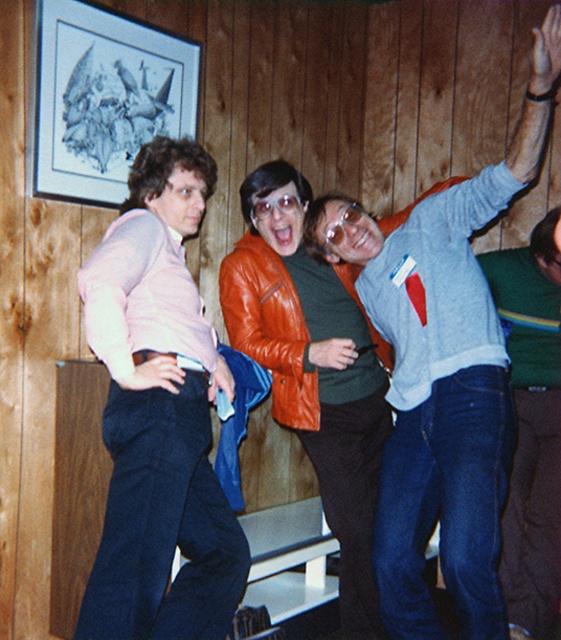
Question: Does light blue sweater at upper right appear over blue jeans at lower right?

Choices:
 (A) no
 (B) yes

Answer: (B)

Question: Based on their relative distances, which object is farther from the leather jacket at center?

Choices:
 (A) light blue sweater at upper right
 (B) blue jeans at lower right

Answer: (B)

Question: Is light blue sweater at upper right positioned in front of blue jeans at lower right?

Choices:
 (A) yes
 (B) no

Answer: (A)

Question: Estimate the real-world distances between objects in this image. Which object is farther from the matte pink sweater at left?

Choices:
 (A) blue jeans at lower right
 (B) light blue sweater at upper right
 (C) leather jacket at center

Answer: (A)

Question: Which point is farther from the camera taking this photo?

Choices:
 (A) 301,403
 (B) 390,289

Answer: (A)

Question: Does light blue sweater at upper right have a lesser width compared to blue jeans at lower right?

Choices:
 (A) no
 (B) yes

Answer: (A)